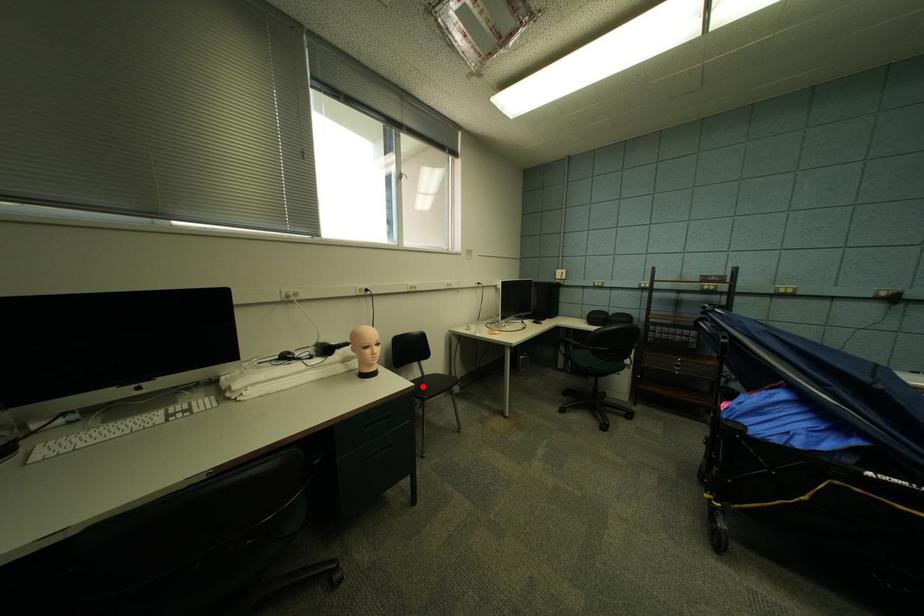
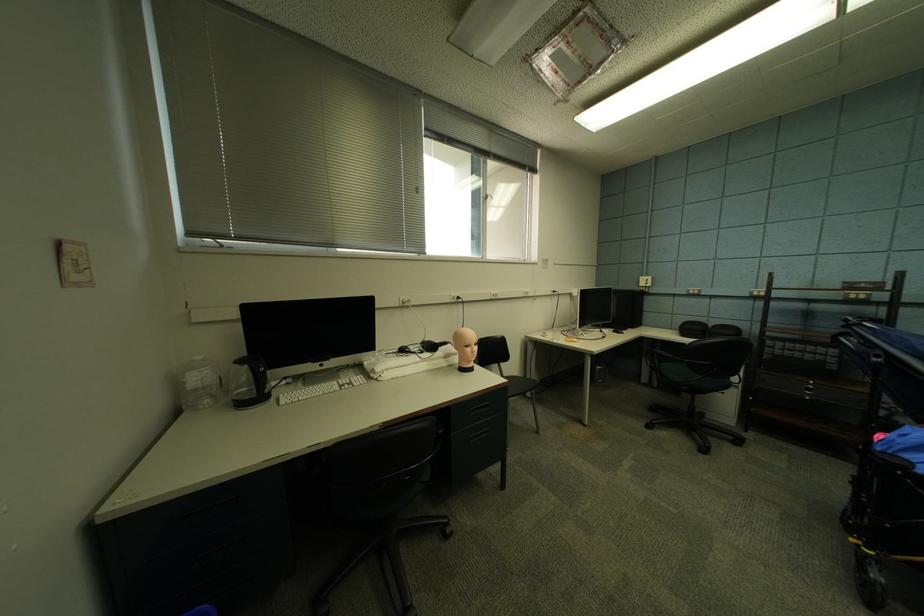
Question: A red point is marked in image1. In image2, is the corresponding 3D point closer to the camera or farther? Reply with the corresponding letter.

Choices:
 (A) The corresponding 3D point is closer.
 (B) The corresponding 3D point is farther.

Answer: (B)